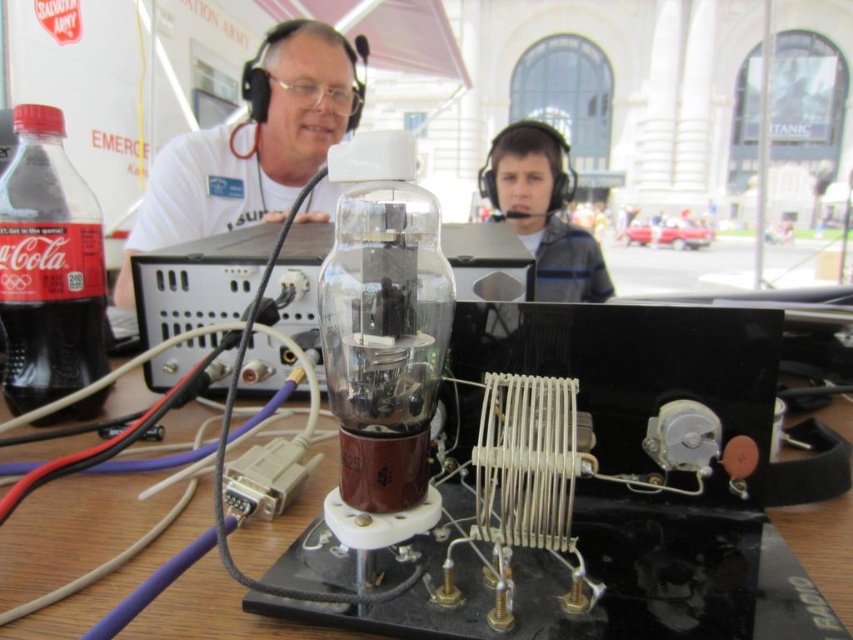
Between white matte glass tube at center and matte gray hoodie at center, which one appears on the right side from the viewer's perspective?

Positioned to the right is matte gray hoodie at center.

Does white matte glass tube at center have a smaller size compared to matte gray hoodie at center?

Actually, white matte glass tube at center might be larger than matte gray hoodie at center.

Where is `white matte glass tube at center`? The image size is (853, 640). white matte glass tube at center is located at coordinates (251, 145).

Image resolution: width=853 pixels, height=640 pixels. In order to click on white matte glass tube at center in this screenshot , I will do `click(251, 145)`.

Does red matte plastic bottle at left lie in front of matte gray hoodie at center?

Yes, it is in front of matte gray hoodie at center.

Between red matte plastic bottle at left and matte gray hoodie at center, which one is positioned higher?

matte gray hoodie at center is higher up.

Does point (32, 141) lie behind point (544, 248)?

That is False.

This screenshot has width=853, height=640. I want to click on red matte plastic bottle at left, so click(x=48, y=268).

Does white matte glass tube at center lie behind red matte plastic bottle at left?

Yes, it is behind red matte plastic bottle at left.

Between point (328, 188) and point (4, 189), which one is positioned in front?

Point (4, 189) is in front.

Does point (270, 195) come farther from viewer compared to point (93, 284)?

Yes.

At what (x,y) coordinates should I click in order to perform the action: click on white matte glass tube at center. Please return your answer as a coordinate pair (x, y). The height and width of the screenshot is (640, 853). Looking at the image, I should click on (251, 145).